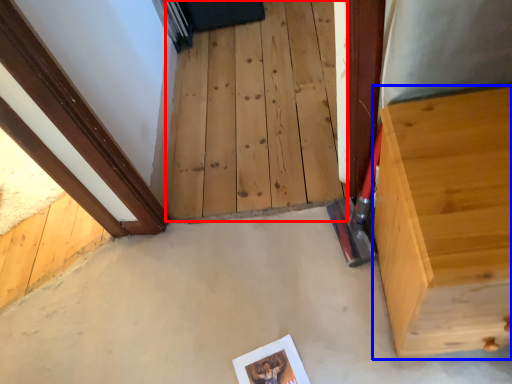
Question: Among these objects, which one is farthest to the camera, stairwell (highlighted by a red box) or furniture (highlighted by a blue box)?

Choices:
 (A) stairwell
 (B) furniture

Answer: (A)